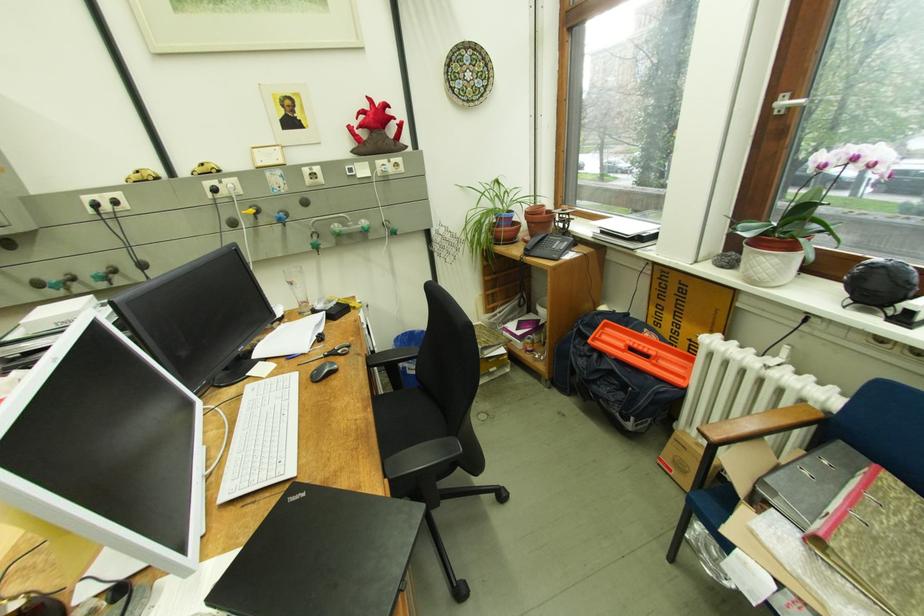
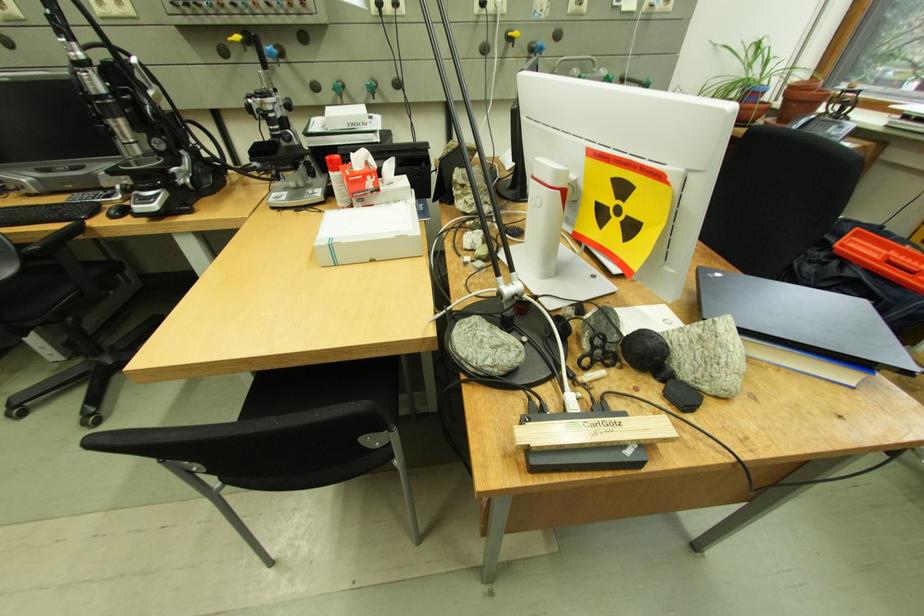
Question: What movement of the cameraman would produce the second image?

Choices:
 (A) Left
 (B) Right
 (C) Forward
 (D) Backward

Answer: (A)